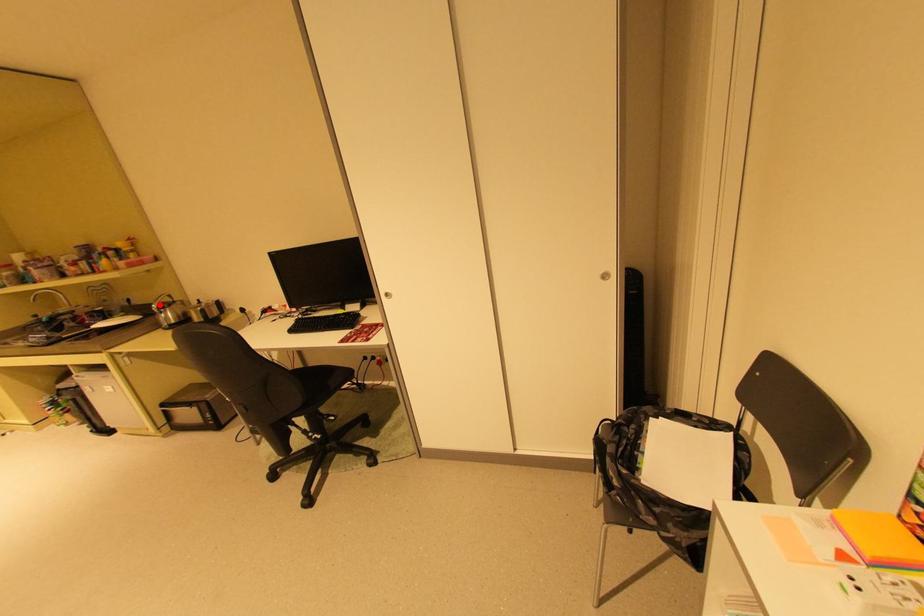
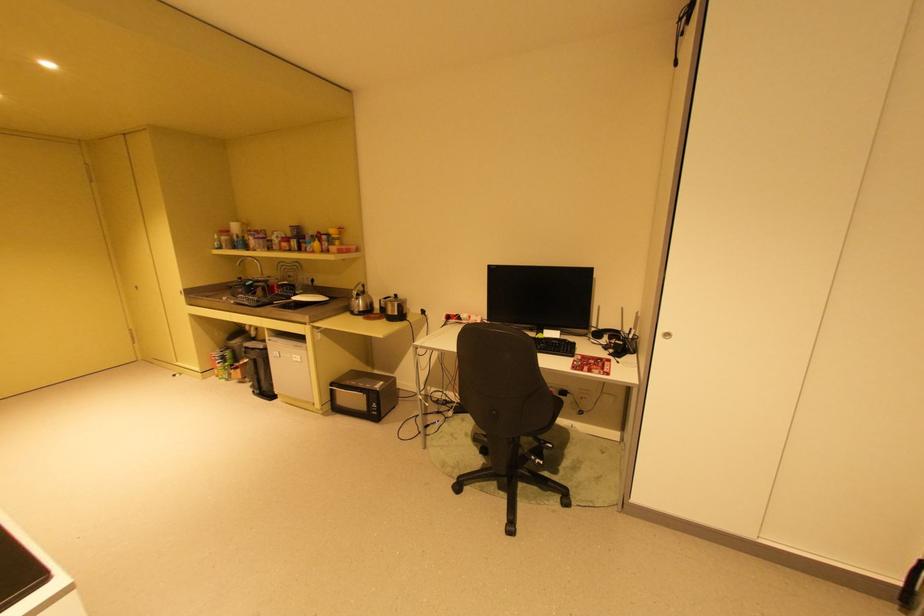
The point at the highlighted location is marked in the first image. Where is the corresponding point in the second image?

(359, 290)